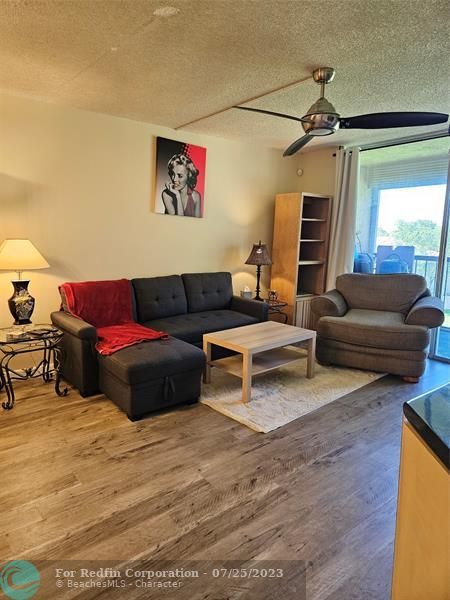
This screenshot has width=450, height=600. In order to click on side table in this screenshot , I will do `click(24, 364)`, `click(267, 303)`.